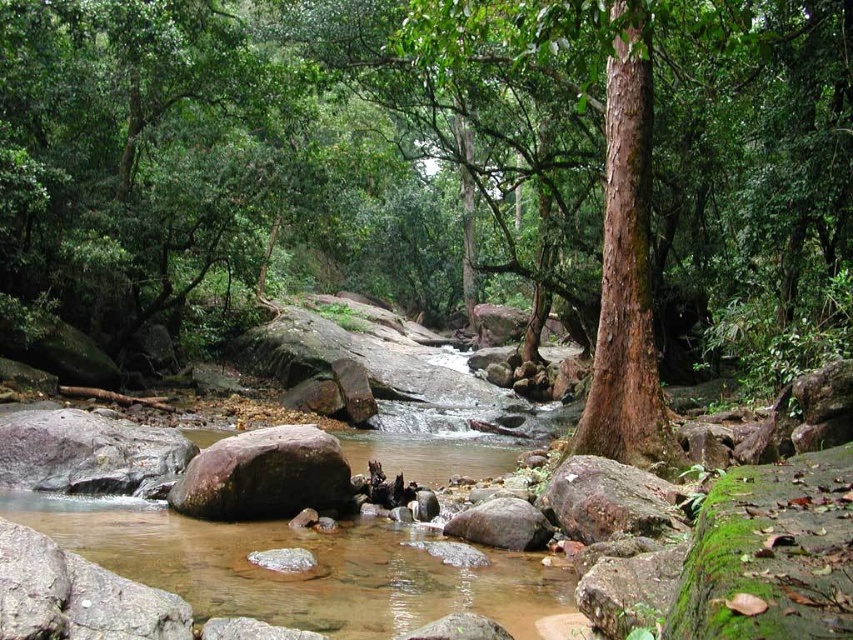
You are standing at the edge of the forest stream and see the brown rough tree at center. If you want to take a photo of it with your camera, which has a maximum zoom range of 5 meters, will you be able to capture the entire tree in the frame without moving closer?

The brown rough tree at center is 5.71 meters away from the camera. Since the camera can only zoom up to 5 meters, you will not be able to capture the entire tree in the frame without moving closer.

You are a hiker who wants to cross the stream. You see the brown rough tree at center and the green mossy rock at center. Which object is higher in the scene?

The brown rough tree at center is above the green mossy rock at center, so the brown rough tree at center is higher in the scene.